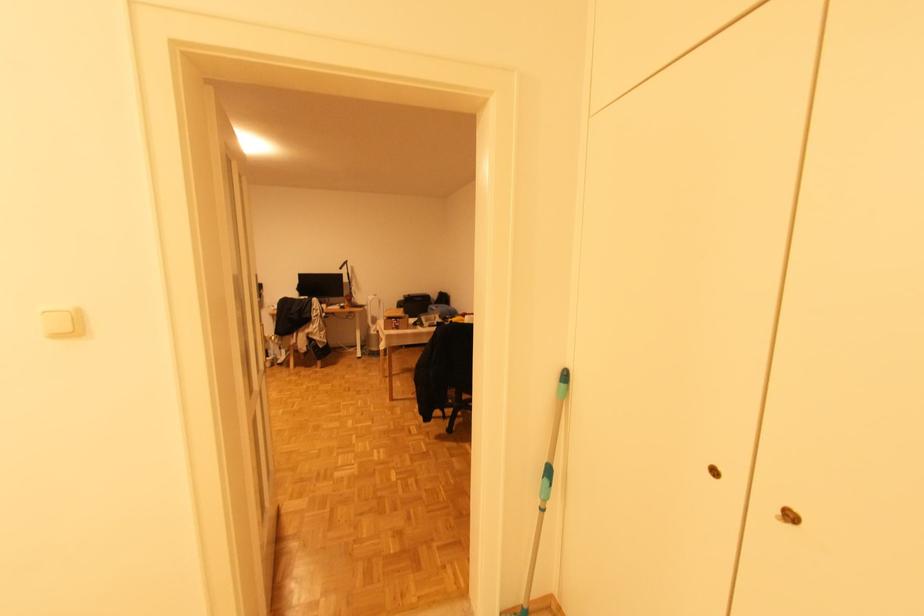
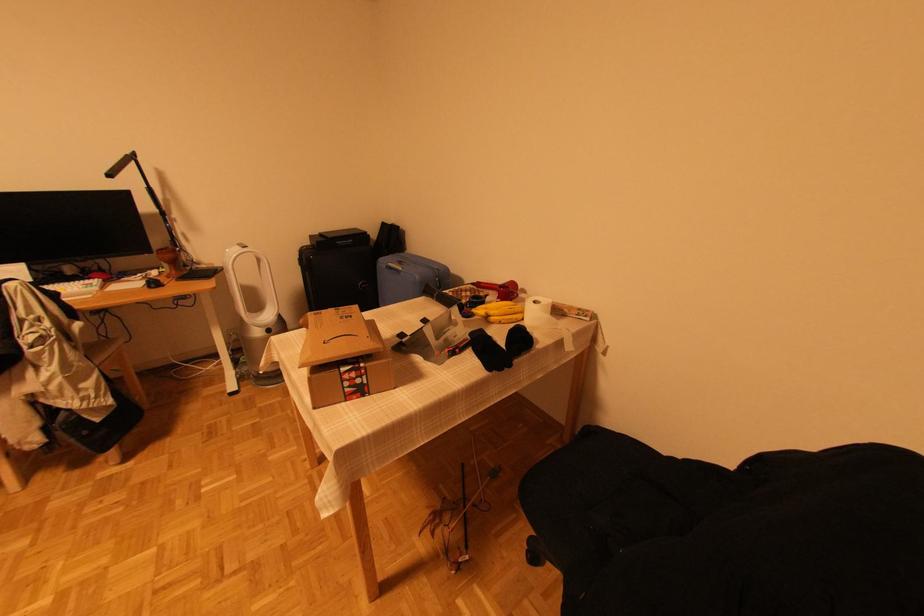
Find the pixel in the second image that matches pixel 407 296 in the first image.

(314, 238)